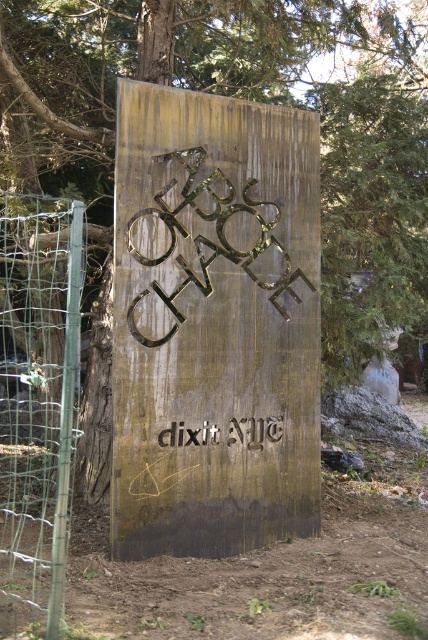
Consider the image. Who is positioned more to the left, wire mesh fence at left or silver metallic text at center?

wire mesh fence at left

Is wire mesh fence at left bigger than silver metallic text at center?

Yes, wire mesh fence at left is bigger than silver metallic text at center.

Who is more forward, (82, 236) or (166, 429)?

Point (82, 236) is more forward.

Find the location of a particular element. The image size is (428, 640). wire mesh fence at left is located at coordinates (36, 400).

Looking at this image, does gold metallic sign at center have a greater height compared to silver metallic text at center?

Indeed, gold metallic sign at center has a greater height compared to silver metallic text at center.

Who is shorter, gold metallic sign at center or silver metallic text at center?

silver metallic text at center

Does point (303, 364) come closer to viewer compared to point (228, 420)?

No, it is not.

You are a GUI agent. You are given a task and a screenshot of the screen. Output one action in this format:
    pyautogui.click(x=<x>, y=<y>)
    Task: Click on the gold metallic sign at center
    The width and height of the screenshot is (428, 640).
    Given the screenshot: What is the action you would take?
    pyautogui.click(x=214, y=321)

Does gold metallic sign at center have a greater height compared to wire mesh fence at left?

Yes.

Is gold metallic sign at center bigger than wire mesh fence at left?

No, gold metallic sign at center is not bigger than wire mesh fence at left.

Locate an element on the screen. gold metallic sign at center is located at coordinates (214, 321).

Find the location of a particular element. gold metallic sign at center is located at coordinates (214, 321).